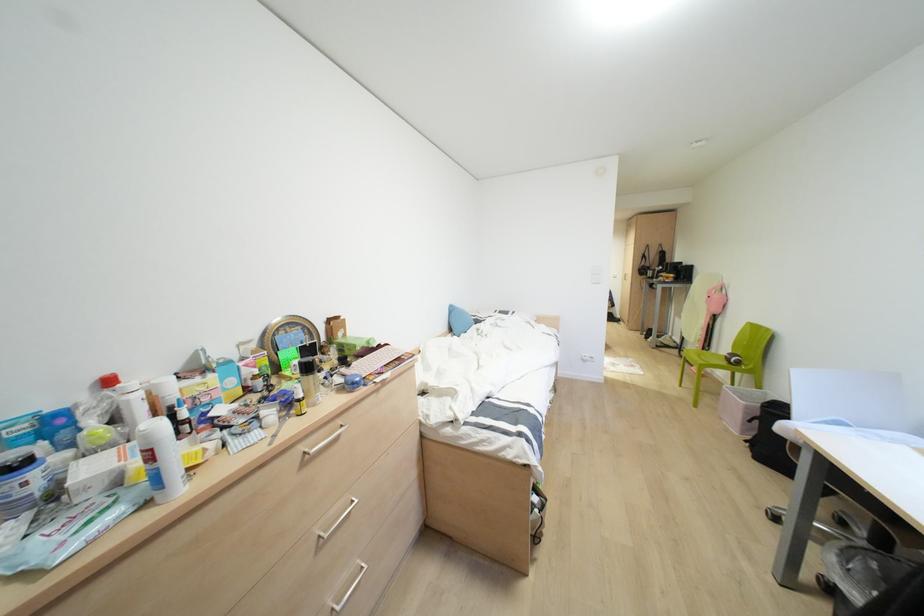
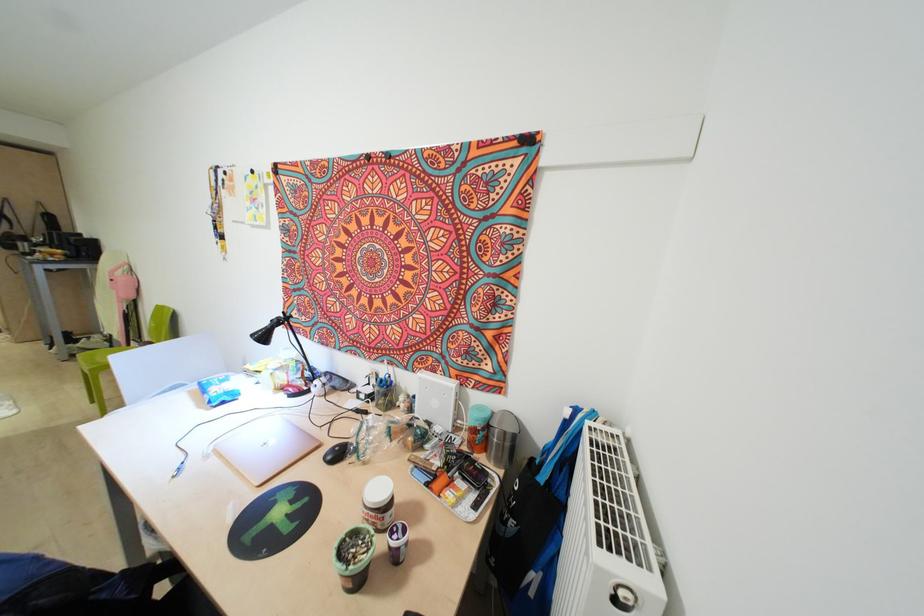
Question: The camera is either moving clockwise (left) or counter-clockwise (right) around the object. The first image is from the beginning of the video and the second image is from the end. Is the camera moving left or right when shooting the video?

Choices:
 (A) Left
 (B) Right

Answer: (A)